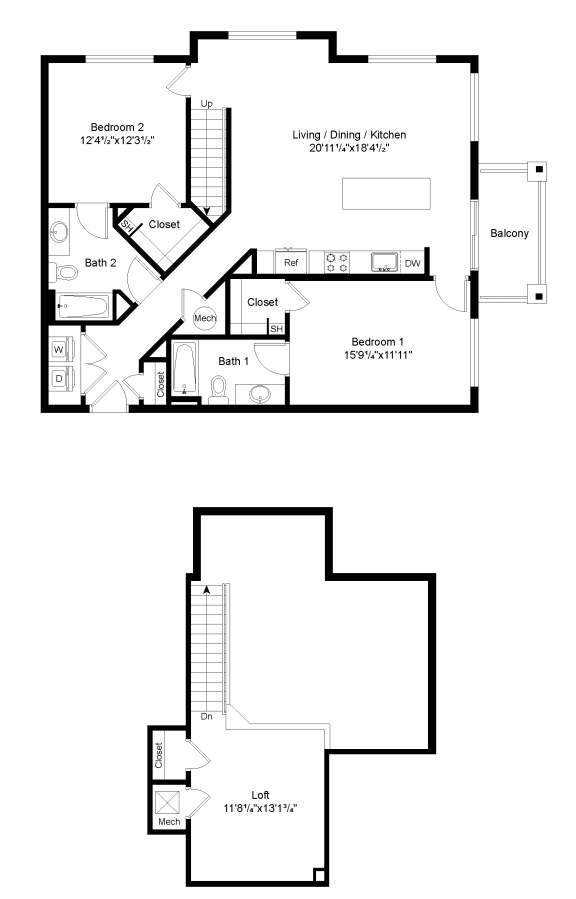
This screenshot has height=899, width=576. Identify the location of kitchen. (339, 263).